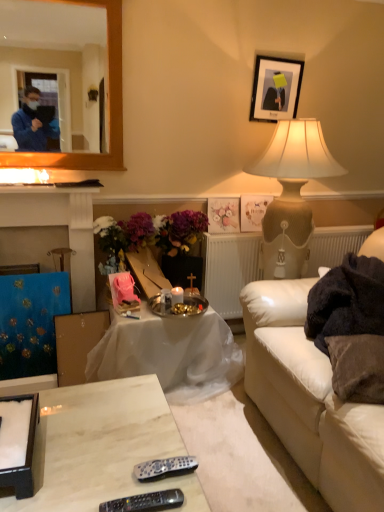
In order to click on free point above marble remote control at lower center, the 2th table from the back (from a real-world perspective) in this screenshot , I will do `click(96, 443)`.